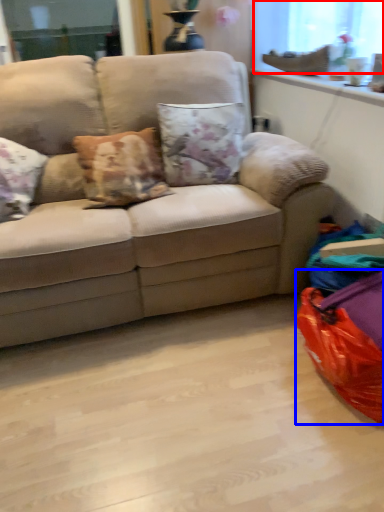
Question: Which object appears closest to the camera in this image, window screen (highlighted by a red box) or bean bag chair (highlighted by a blue box)?

Choices:
 (A) window screen
 (B) bean bag chair

Answer: (B)